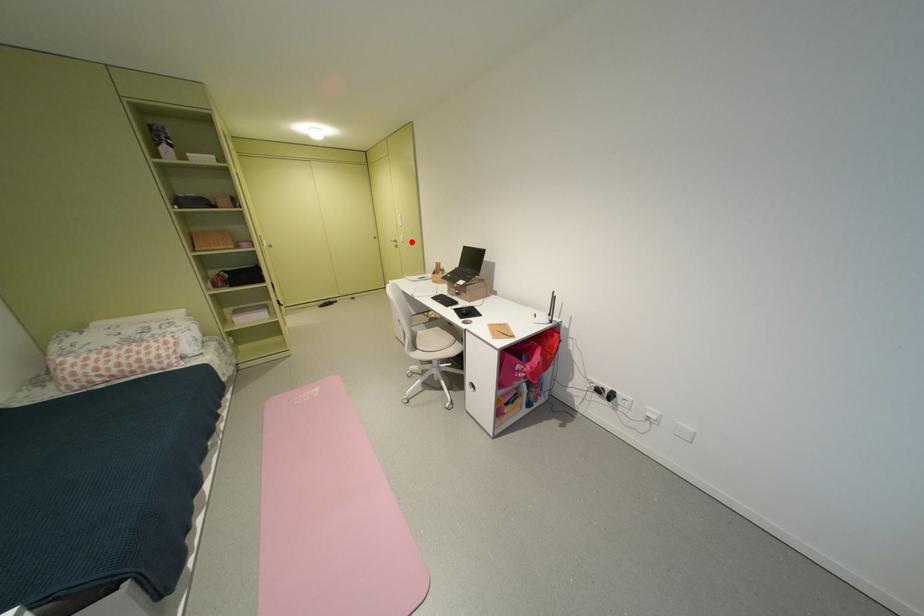
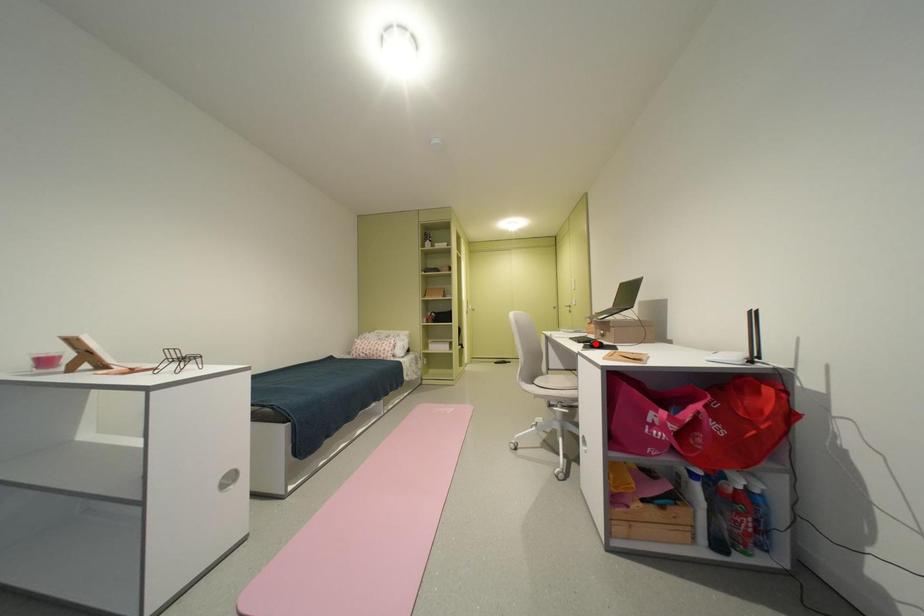
I am providing you with two images of the same scene from different viewpoints. A red point is marked on the first image and another point is marked on the second image. Is the marked point in image1 the same physical position as the marked point in image2?

No